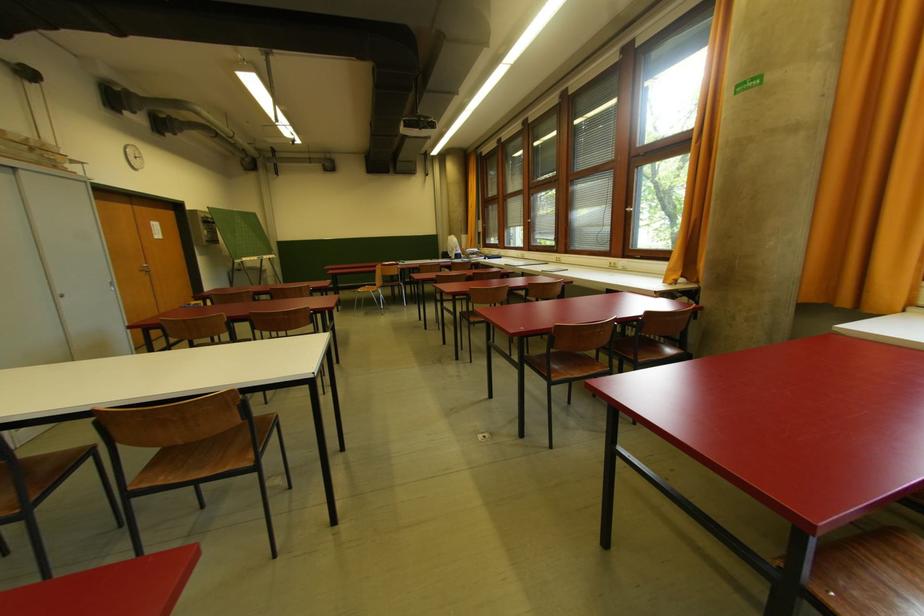
This screenshot has height=616, width=924. What are the coordinates of `metal door handle` in the screenshot? It's located at (144, 268).